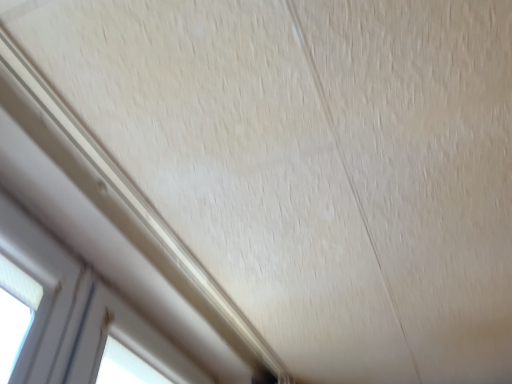
Question: Is white plastic window at lower left, the second window positioned from the back, completely or partially inside white plastic window at lower left, the second window from the top?

Choices:
 (A) no
 (B) yes

Answer: (A)

Question: Can you confirm if white plastic window at lower left, marked as the second window in a left-to-right arrangement, is smaller than white plastic window at lower left, positioned as the 1th window in left-to-right order?

Choices:
 (A) yes
 (B) no

Answer: (B)

Question: Can you confirm if white plastic window at lower left, marked as the second window in a left-to-right arrangement, is thinner than white plastic window at lower left, which is the 2th window in right-to-left order?

Choices:
 (A) no
 (B) yes

Answer: (A)

Question: Is white plastic window at lower left, marked as the second window in a left-to-right arrangement, closer to the viewer compared to white plastic window at lower left, positioned as the 1th window in left-to-right order?

Choices:
 (A) no
 (B) yes

Answer: (A)

Question: Is white plastic window at lower left, the first window positioned from the bottom, completely or partially outside of white plastic window at lower left, acting as the second window starting from the bottom?

Choices:
 (A) yes
 (B) no

Answer: (A)

Question: Is white plastic window at lower left, the 1th window in the back-to-front sequence, positioned behind white plastic window at lower left, which is the 2th window in right-to-left order?

Choices:
 (A) no
 (B) yes

Answer: (B)

Question: From a real-world perspective, is white plastic window at lower left, which is the 2th window in right-to-left order, on white plastic window at lower left, arranged as the second window when viewed from the front?

Choices:
 (A) no
 (B) yes

Answer: (B)

Question: Is white plastic window at lower left, acting as the second window starting from the bottom, taller than white plastic window at lower left, the first window positioned from the bottom?

Choices:
 (A) no
 (B) yes

Answer: (A)

Question: Does white plastic window at lower left, positioned as the 1th window in left-to-right order, come behind white plastic window at lower left, the first window positioned from the bottom?

Choices:
 (A) no
 (B) yes

Answer: (A)

Question: From the image's perspective, is white plastic window at lower left, the second window positioned from the back, located beneath white plastic window at lower left, the first window positioned from the bottom?

Choices:
 (A) yes
 (B) no

Answer: (B)

Question: Is white plastic window at lower left, positioned as the 1th window in left-to-right order, to the left of white plastic window at lower left, the 1th window in the back-to-front sequence, from the viewer's perspective?

Choices:
 (A) yes
 (B) no

Answer: (A)

Question: Is white plastic window at lower left, which is the 2th window in right-to-left order, wider than white plastic window at lower left, the first window positioned from the bottom?

Choices:
 (A) no
 (B) yes

Answer: (A)

Question: Do you think white plastic window at lower left, placed as the first window when sorted from right to left, is within white plastic window at lower left, acting as the second window starting from the bottom, or outside of it?

Choices:
 (A) outside
 (B) inside

Answer: (A)